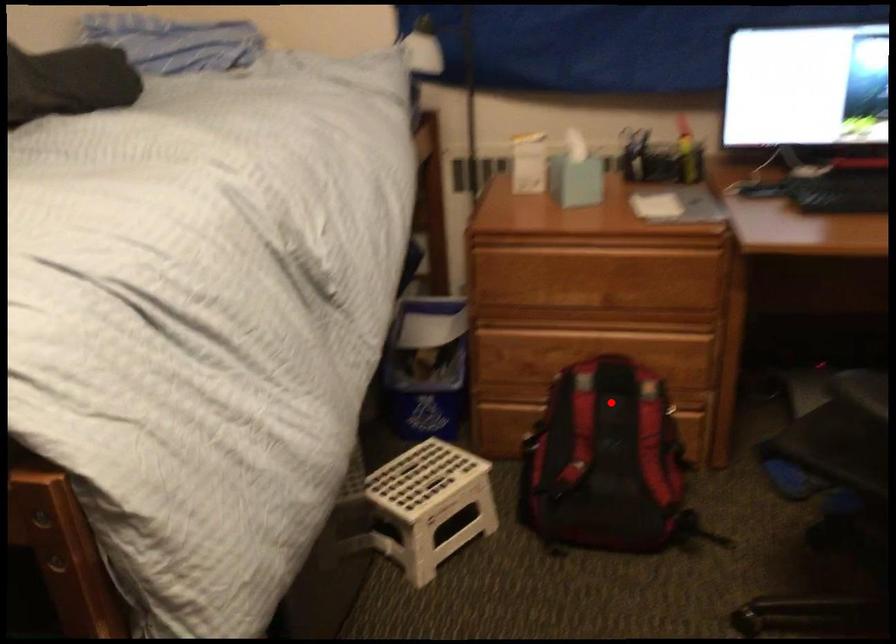
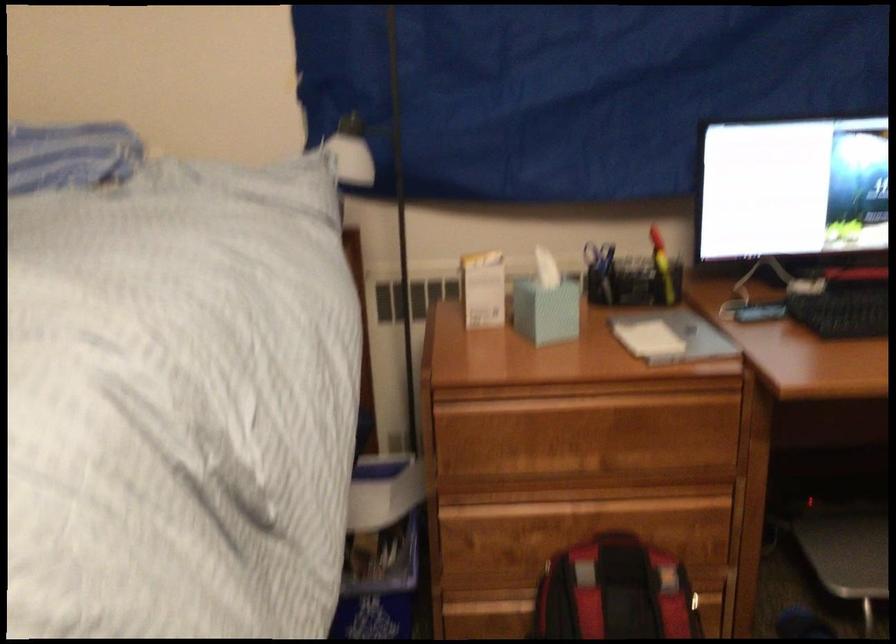
The point at the highlighted location is marked in the first image. Where is the corresponding point in the second image?

(615, 592)